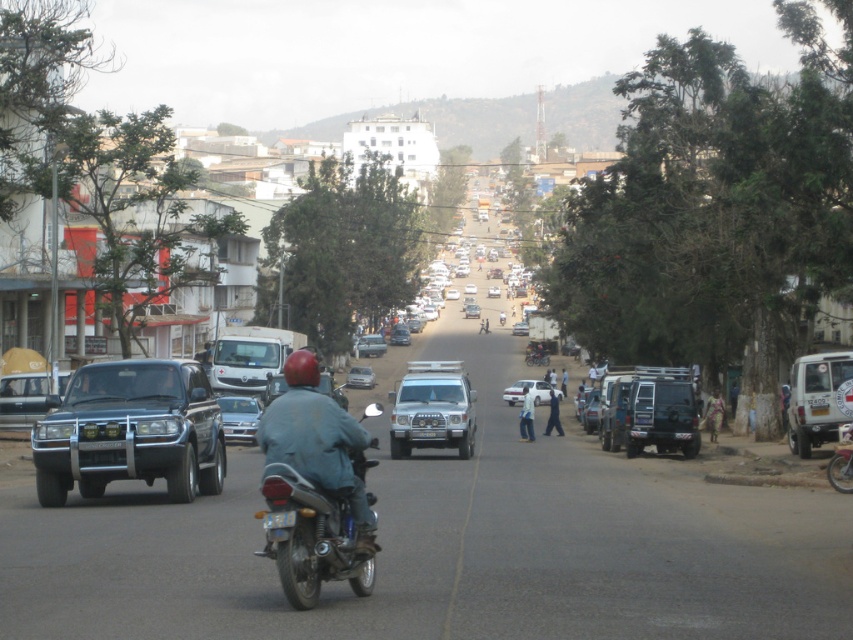
You are a photographer standing at the center of the street. You notice a white fabric shirt at center and a white plastic license plate at center. Which object is taller when viewed from your position?

The white fabric shirt at center is much taller than the white plastic license plate at center.

You are a delivery person who needs to carry a large package that requires a minimum height clearance of 1.8 meters. You see the metallic blue truck at left and the light brown fabric dress at lower right in the scene. Which object is taller and can accommodate the package?

The metallic blue truck at left is much taller than the light brown fabric dress at lower right, so the metallic blue truck at left can accommodate the package requiring a minimum height clearance of 1.8 meters.